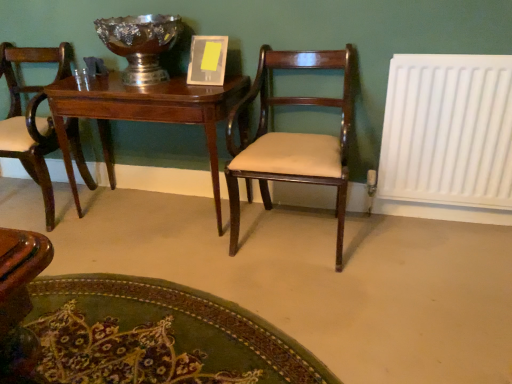
The height and width of the screenshot is (384, 512). Identify the location of free location in front of white plastic radiator at right. (446, 262).